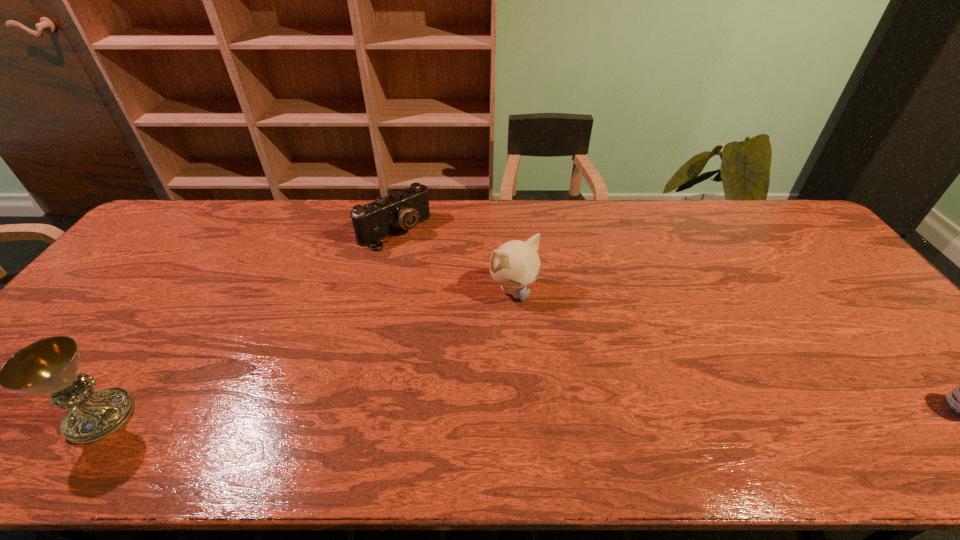
Locate an element on the screen. This screenshot has height=540, width=960. empty location between the third shortest object and the farthest object is located at coordinates (454, 260).

What are the coordinates of `vacant point located between the camera and the leftmost object` in the screenshot? It's located at (248, 323).

The width and height of the screenshot is (960, 540). Find the location of `object identified as the closest to the second farthest object`. object identified as the closest to the second farthest object is located at coordinates (402, 210).

Where is `object that is the third nearest to the second tallest object`? This screenshot has width=960, height=540. object that is the third nearest to the second tallest object is located at coordinates (959, 400).